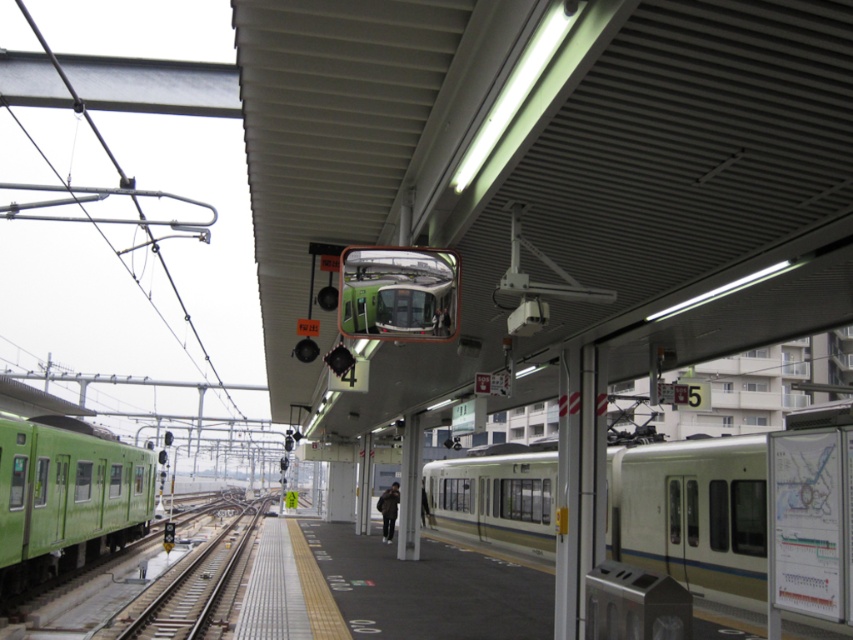
You are a GUI agent. You are given a task and a screenshot of the screen. Output one action in this format:
    pyautogui.click(x=<x>, y=<y>)
    Task: Click on the silver metallic train at right
    
    Given the screenshot: What is the action you would take?
    pyautogui.click(x=693, y=515)

Between point (608, 481) and point (144, 632), which one is positioned in front?

Point (144, 632)

The width and height of the screenshot is (853, 640). Find the location of `silver metallic train at right`. silver metallic train at right is located at coordinates (693, 515).

Which is above, green matte train at left or green metallic train track at center?

green matte train at left is higher up.

Between green matte train at left and green metallic train track at center, which one is positioned lower?

green metallic train track at center

What do you see at coordinates (67, 497) in the screenshot?
I see `green matte train at left` at bounding box center [67, 497].

Locate an element on the screen. This screenshot has width=853, height=640. green matte train at left is located at coordinates (67, 497).

Is silver metallic train at right positioned at the back of green matte train at left?

No, it is in front of green matte train at left.

Who is higher up, silver metallic train at right or green matte train at left?

silver metallic train at right

Between point (450, 484) and point (149, 484), which one is positioned in front?

Point (149, 484)

What are the coordinates of `silver metallic train at right` in the screenshot? It's located at (693, 515).